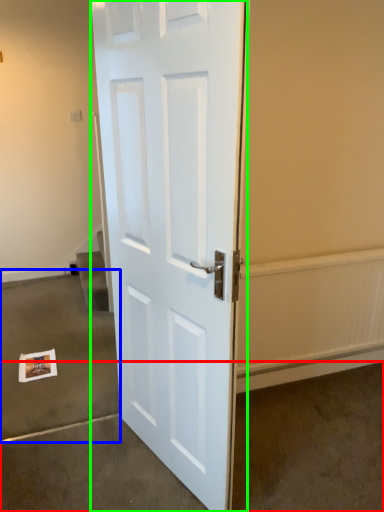
Question: Which object is the closest to the concrete (highlighted by a red box)? Choose among these: concrete (highlighted by a blue box) or door (highlighted by a green box).

Choices:
 (A) concrete
 (B) door

Answer: (B)